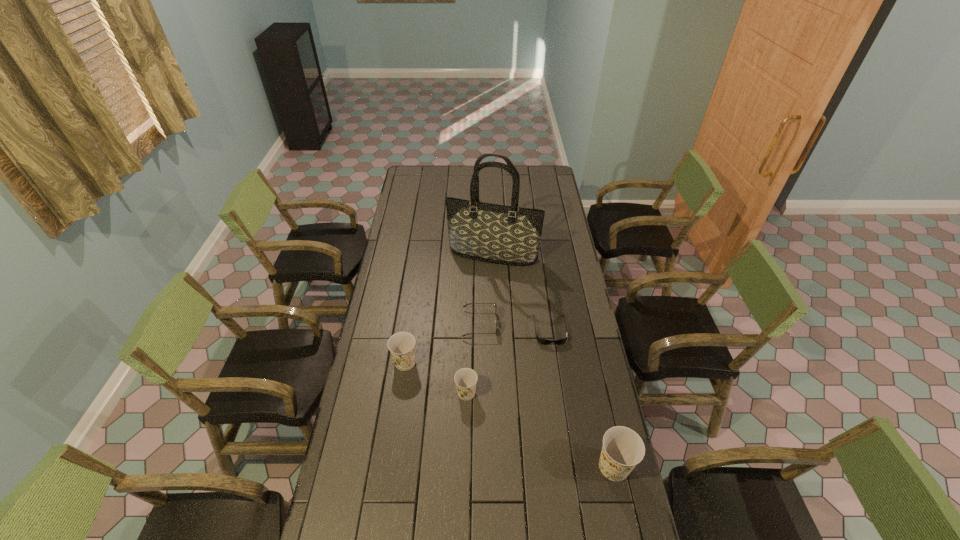
Identify the location of sunglasses positioned at the right edge. The height and width of the screenshot is (540, 960). (542, 341).

Locate an element on the screen. free spot at the far edge of the desktop is located at coordinates (516, 167).

This screenshot has height=540, width=960. Identify the location of free space at the left edge of the desktop. (385, 312).

Locate an element on the screen. vacant space at the right edge of the desktop is located at coordinates (541, 247).

You are a GUI agent. You are given a task and a screenshot of the screen. Output one action in this format:
    pyautogui.click(x=<x>, y=<y>)
    Task: Click on the free location at the far left corner
    
    Given the screenshot: What is the action you would take?
    pyautogui.click(x=415, y=171)

This screenshot has width=960, height=540. I want to click on free space at the near left corner, so click(x=327, y=534).

Where is `vacant region at the far right corner of the desktop`? The height and width of the screenshot is (540, 960). vacant region at the far right corner of the desktop is located at coordinates (545, 169).

This screenshot has width=960, height=540. I want to click on free region at the near right corner of the desktop, so click(x=599, y=536).

Where is `blank region between the farthest object and the left sunglasses`? The image size is (960, 540). blank region between the farthest object and the left sunglasses is located at coordinates (487, 289).

Locate an element on the screen. Image resolution: width=960 pixels, height=540 pixels. unoccupied area between the shortest object and the farthest Dixie cup is located at coordinates (477, 346).